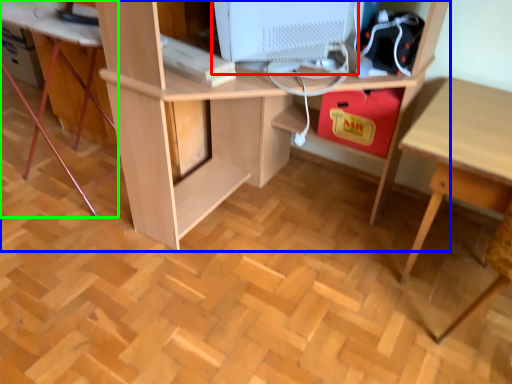
Question: Which object is positioned farthest from computer monitor (highlighted by a red box)? Select from desk (highlighted by a blue box) and computer desk (highlighted by a green box).

Choices:
 (A) desk
 (B) computer desk

Answer: (B)